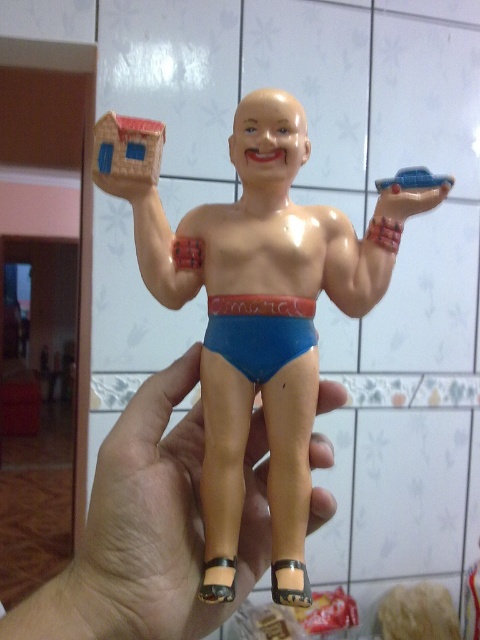
Who is shorter, blue matte diaper at center or blue plastic car at upper right?

blue plastic car at upper right is shorter.

Is blue matte diaper at center positioned behind blue plastic car at upper right?

No, blue matte diaper at center is in front of blue plastic car at upper right.

Describe the element at coordinates (260, 332) in the screenshot. The height and width of the screenshot is (640, 480). I see `blue matte diaper at center` at that location.

The image size is (480, 640). Find the location of `blue matte diaper at center`. blue matte diaper at center is located at coordinates (260, 332).

Does point (220, 616) come behind point (422, 182)?

That is False.

Between matte plastic hand at lower center and blue plastic car at upper right, which one appears on the right side from the viewer's perspective?

Positioned to the right is blue plastic car at upper right.

Measure the distance between point (188, 588) and camera.

21.76 inches

At what (x,y) coordinates should I click in order to perform the action: click on matte plastic hand at lower center. Please return your answer as a coordinate pair (x, y). The width and height of the screenshot is (480, 640). Looking at the image, I should click on (172, 502).

Which is in front, point (276, 168) or point (243, 465)?

Positioned in front is point (276, 168).

In the scene shown: Does matte plastic toy at center appear on the right side of matte plastic hand at lower center?

Yes, matte plastic toy at center is to the right of matte plastic hand at lower center.

The width and height of the screenshot is (480, 640). What do you see at coordinates (262, 317) in the screenshot?
I see `matte plastic toy at center` at bounding box center [262, 317].

Image resolution: width=480 pixels, height=640 pixels. In order to click on matte plastic toy at center in this screenshot , I will do `click(262, 317)`.